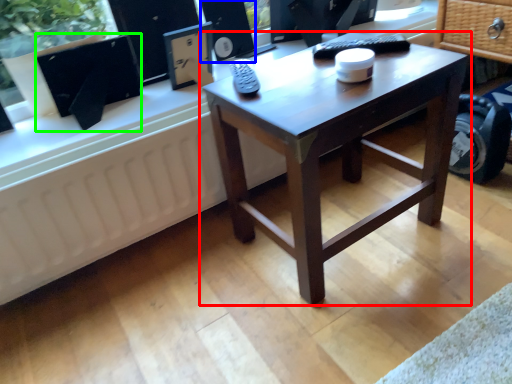
Question: Which is nearer to the coffee table (highlighted by a red box)? speaker (highlighted by a blue box) or computer monitor (highlighted by a green box).

Choices:
 (A) speaker
 (B) computer monitor

Answer: (B)